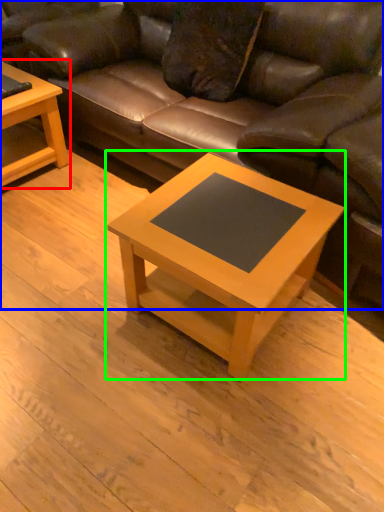
Question: Which object is the farthest from coffee table (highlighted by a red box)? Choose among these: studio couch (highlighted by a blue box) or coffee table (highlighted by a green box).

Choices:
 (A) studio couch
 (B) coffee table

Answer: (B)